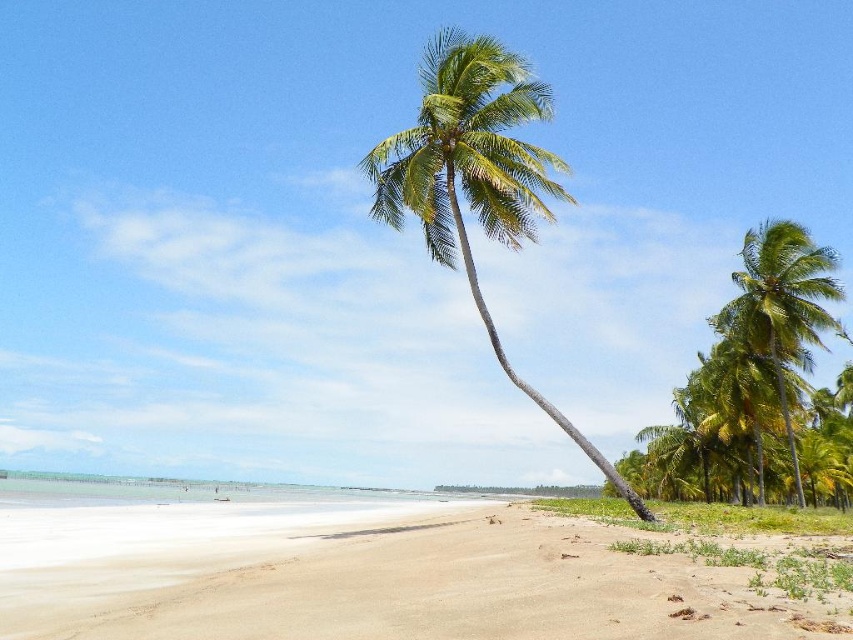
Question: Estimate the real-world distances between objects in this image. Which object is closer to the sandy beach at lower center?

Choices:
 (A) green leafy palm tree at center
 (B) green leafy palm tree at right

Answer: (A)

Question: Is sandy beach at lower center closer to the viewer compared to green leafy palm tree at right?

Choices:
 (A) yes
 (B) no

Answer: (A)

Question: Which point is closer to the camera?

Choices:
 (A) (19, 524)
 (B) (822, 330)
 (C) (514, 116)

Answer: (C)

Question: Considering the relative positions of sandy beach at lower center and green leafy palm tree at right in the image provided, where is sandy beach at lower center located with respect to green leafy palm tree at right?

Choices:
 (A) left
 (B) right

Answer: (A)

Question: Is green leafy palm tree at center positioned at the back of green leafy palm tree at right?

Choices:
 (A) no
 (B) yes

Answer: (A)

Question: Which object appears closest to the camera in this image?

Choices:
 (A) sandy beach at lower center
 (B) green leafy palm tree at right
 (C) green leafy palm tree at center

Answer: (A)